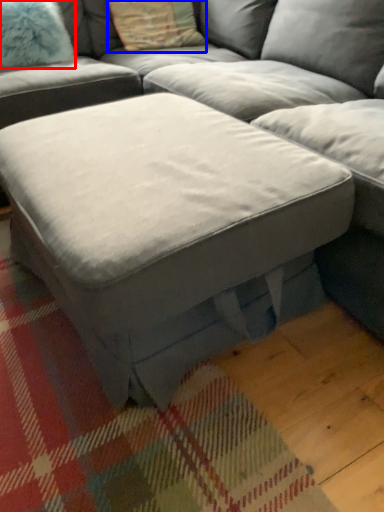
Question: Which object appears farthest to the camera in this image, pillow (highlighted by a red box) or pillow (highlighted by a blue box)?

Choices:
 (A) pillow
 (B) pillow

Answer: (B)